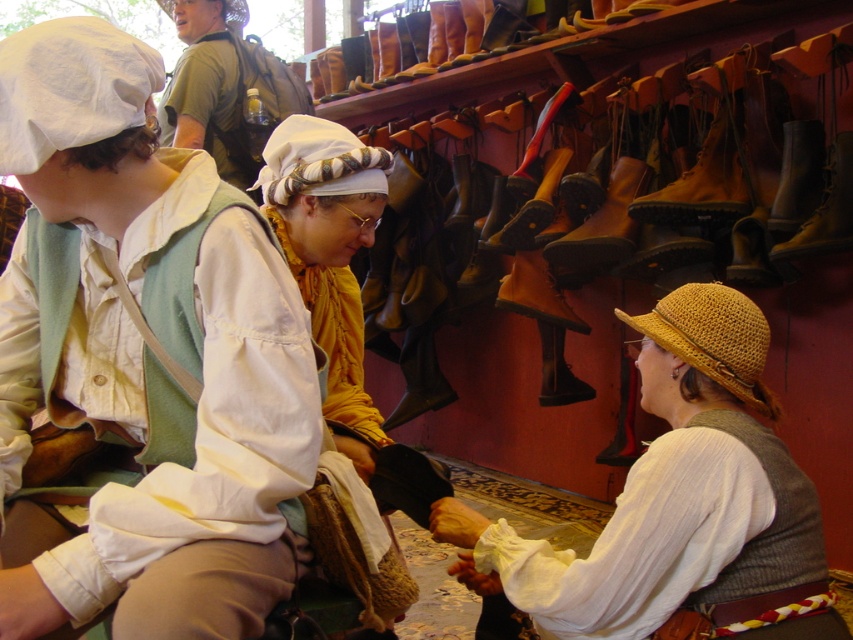
From the picture: You are a visitor in this historical shop and want to know which hat is taller between the white woven hat at center and the white woven straw hat at upper center. Can you tell me?

The white woven hat at center is much taller than the white woven straw hat at upper center.

You are a visitor at this historical shop and want to know which hat is taller between the straw hat at center and the white woven straw hat at upper center. Can you tell me?

The straw hat at center is much taller than the white woven straw hat at upper center according to the description.

You are a customer in this shop and want to pick up both the golden straw hat at lower right and the white woven straw hat at upper center. Can you reach both without moving your position? The average human arm length is 0.7 meters.

The golden straw hat at lower right and the white woven straw hat at upper center are 2.55 meters apart. Since the average human arm length is 0.7 meters, you cannot reach both hats simultaneously without moving your position.